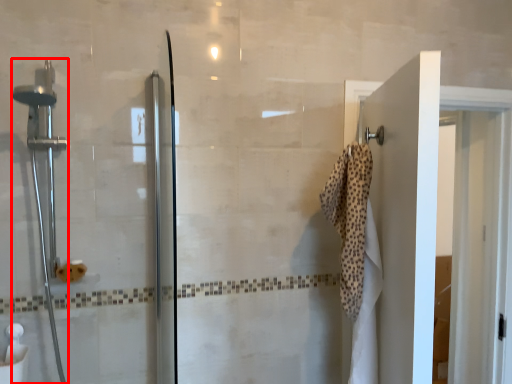
Question: Considering the relative positions of shower (annotated by the red box) and bath towel in the image provided, where is shower (annotated by the red box) located with respect to the staircase?

Choices:
 (A) left
 (B) right

Answer: (A)